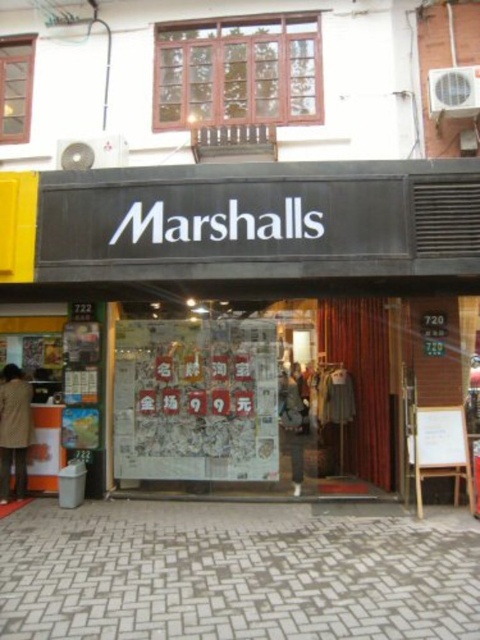
Measure the distance from matte black clothing store at center to beige wool coat at lower left.

matte black clothing store at center is 1.36 meters from beige wool coat at lower left.

Which is in front, point (403, 477) or point (11, 381)?

Point (403, 477)

Find the location of a particular element. matte black clothing store at center is located at coordinates (254, 314).

Does beige wool coat at lower left come in front of clear glass window at upper left?

Yes, beige wool coat at lower left is in front of clear glass window at upper left.

Measure the distance between beige wool coat at lower left and camera.

7.53 meters

Find the location of a particular element. The width and height of the screenshot is (480, 640). beige wool coat at lower left is located at coordinates (13, 429).

You are a GUI agent. You are given a task and a screenshot of the screen. Output one action in this format:
    pyautogui.click(x=<x>, y=<y>)
    Task: Click on the wooden frame at upper center
    
    Given the screenshot: What is the action you would take?
    click(x=238, y=72)

Does wooden frame at upper center have a lesser height compared to clear glass window at upper left?

Incorrect, wooden frame at upper center's height does not fall short of clear glass window at upper left's.

This screenshot has height=640, width=480. What are the coordinates of `wooden frame at upper center` in the screenshot? It's located at (238, 72).